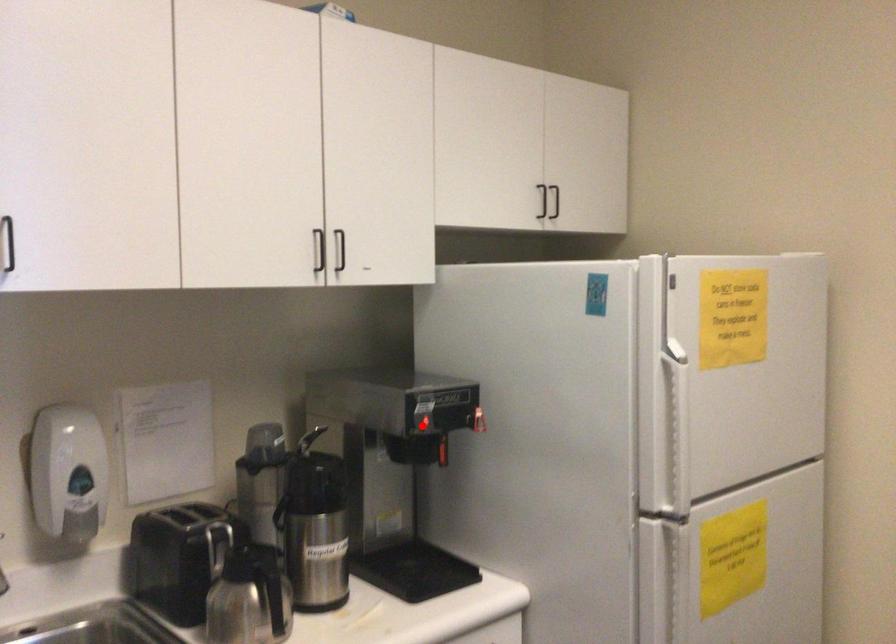
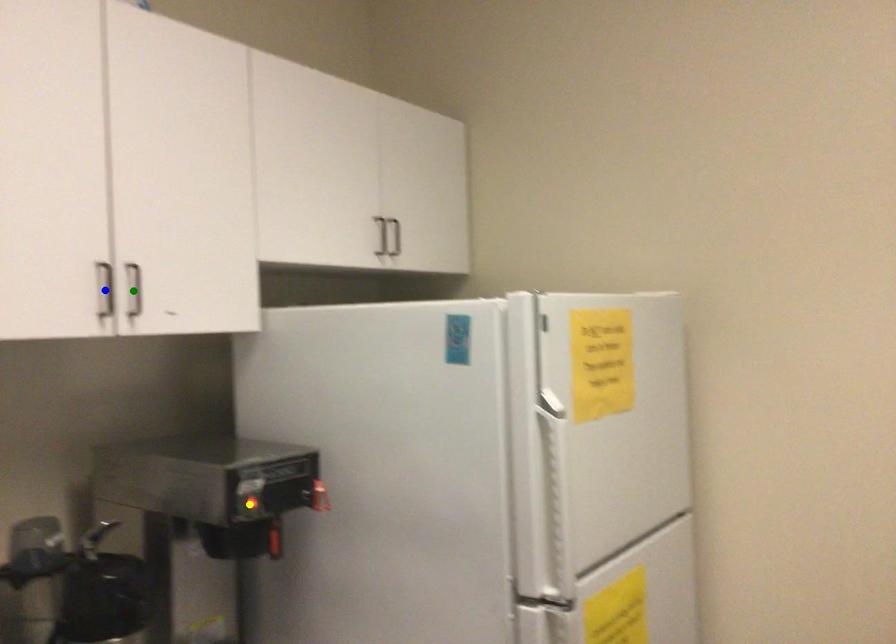
Question: I am providing you with two images of the same scene from different viewpoints. A red point is marked on the first image. You are given multiple points on the second image. Which point in image 2 represents the same 3d spot as the red point in image 1?

Choices:
 (A) blue point
 (B) yellow point
 (C) green point

Answer: (B)